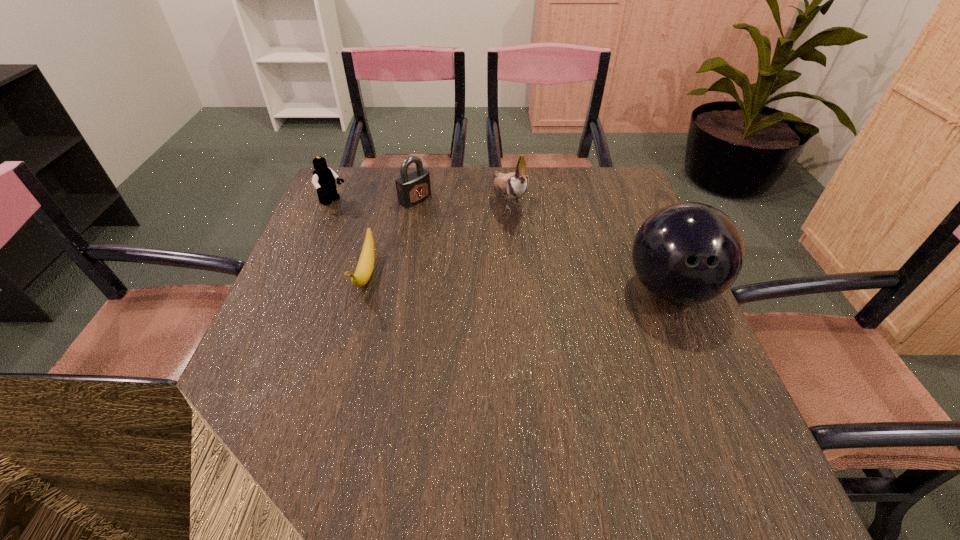
You are a GUI agent. You are given a task and a screenshot of the screen. Output one action in this format:
    pyautogui.click(x=<x>, y=<y>)
    Task: Click on the free space located 0.270m on the front-facing side of the Lego
    The height and width of the screenshot is (540, 960).
    Given the screenshot: What is the action you would take?
    pyautogui.click(x=412, y=243)

You are a GUI agent. You are given a task and a screenshot of the screen. Output one action in this format:
    pyautogui.click(x=<x>, y=<y>)
    Task: Click on the vacant space situated at the face of the second object from right to left
    The image size is (960, 540).
    Given the screenshot: What is the action you would take?
    pyautogui.click(x=540, y=272)

Find the location of a particular element. blank space located 0.270m at the face of the second object from right to left is located at coordinates (552, 295).

Locate an element on the screen. This screenshot has width=960, height=540. vacant space located 0.270m at the face of the second object from right to left is located at coordinates (552, 295).

Identify the location of free space located on the front of the third object from right to left near the keyhole. This screenshot has width=960, height=540. (437, 213).

Where is `free space located on the front of the third object from right to left near the keyhole`? This screenshot has width=960, height=540. free space located on the front of the third object from right to left near the keyhole is located at coordinates (473, 237).

Identify the location of blank area located on the front of the third object from right to left near the keyhole. (492, 249).

The image size is (960, 540). I want to click on Lego at the far edge, so click(x=324, y=178).

Locate an element on the screen. bird at the far edge is located at coordinates (513, 185).

The width and height of the screenshot is (960, 540). Find the location of `padlock that is at the far edge`. padlock that is at the far edge is located at coordinates (412, 188).